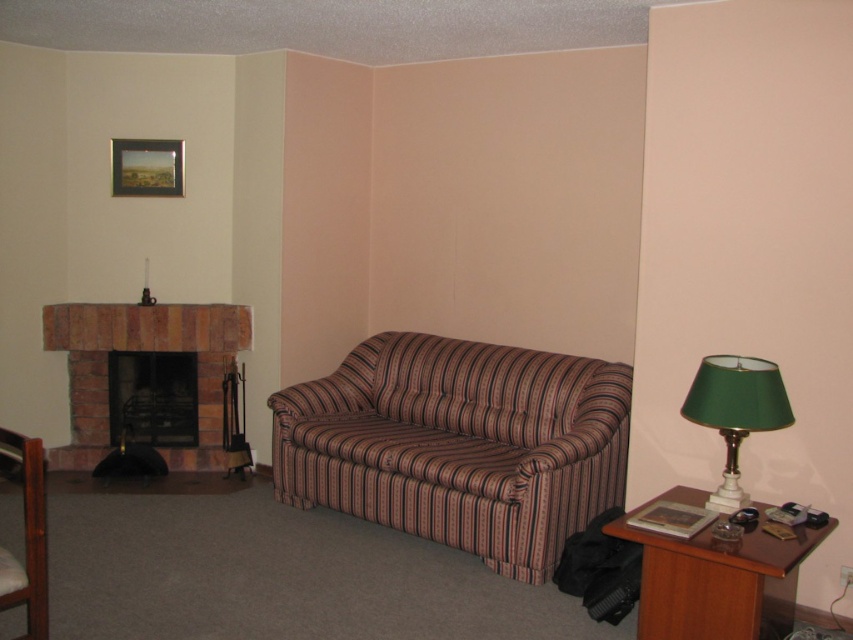
You are standing in the living room and want to know how far you are from the point marked as point (83, 424). Can you determine the distance?

The point (83, 424) is 4.73 meters from the viewer.